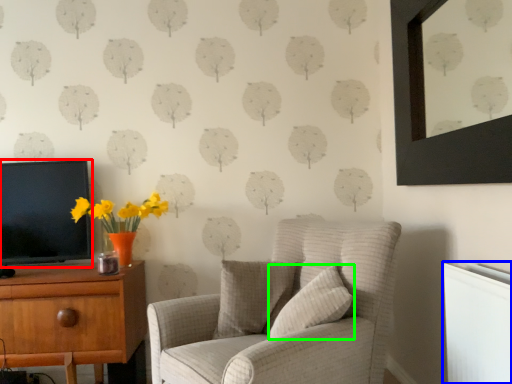
Question: Which object is the closest to the television (highlighted by a red box)? Choose among these: radiator (highlighted by a blue box) or pillow (highlighted by a green box).

Choices:
 (A) radiator
 (B) pillow

Answer: (B)